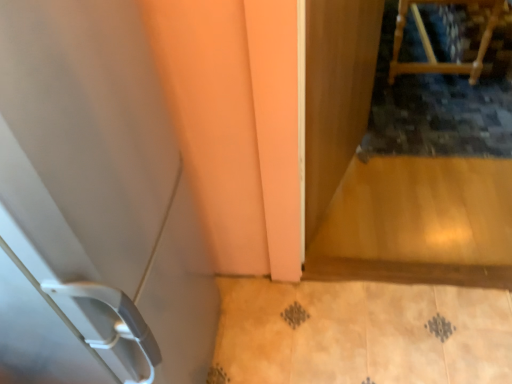
Question: Considering the relative sizes of wooden chair at upper right and transparent wooden screen door at upper right in the image provided, is wooden chair at upper right taller than transparent wooden screen door at upper right?

Choices:
 (A) no
 (B) yes

Answer: (A)

Question: Is wooden chair at upper right far from transparent wooden screen door at upper right?

Choices:
 (A) no
 (B) yes

Answer: (B)

Question: Does wooden chair at upper right turn towards transparent wooden screen door at upper right?

Choices:
 (A) yes
 (B) no

Answer: (B)

Question: Does wooden chair at upper right have a lesser width compared to transparent wooden screen door at upper right?

Choices:
 (A) no
 (B) yes

Answer: (A)

Question: From a real-world perspective, is wooden chair at upper right positioned under transparent wooden screen door at upper right based on gravity?

Choices:
 (A) yes
 (B) no

Answer: (A)

Question: Choose the correct answer: Is wooden chair at upper right inside white plastic door at left or outside it?

Choices:
 (A) inside
 (B) outside

Answer: (B)

Question: From the image's perspective, is wooden chair at upper right above or below white plastic door at left?

Choices:
 (A) below
 (B) above

Answer: (B)

Question: From a real-world perspective, is wooden chair at upper right positioned above or below white plastic door at left?

Choices:
 (A) below
 (B) above

Answer: (A)

Question: Looking at the image, does wooden chair at upper right seem bigger or smaller compared to white plastic door at left?

Choices:
 (A) small
 (B) big

Answer: (A)

Question: From a real-world perspective, is wooden chair at upper right physically located above or below transparent wooden screen door at upper right?

Choices:
 (A) below
 (B) above

Answer: (A)

Question: From the image's perspective, is wooden chair at upper right positioned above or below transparent wooden screen door at upper right?

Choices:
 (A) above
 (B) below

Answer: (A)

Question: Relative to transparent wooden screen door at upper right, is wooden chair at upper right in front or behind?

Choices:
 (A) behind
 (B) front

Answer: (A)

Question: Considering the positions of point pyautogui.click(x=493, y=6) and point pyautogui.click(x=357, y=117), is point pyautogui.click(x=493, y=6) closer or farther from the camera than point pyautogui.click(x=357, y=117)?

Choices:
 (A) farther
 (B) closer

Answer: (A)

Question: From the image's perspective, is white plastic door at left positioned above or below transparent wooden screen door at upper right?

Choices:
 (A) above
 (B) below

Answer: (B)

Question: From a real-world perspective, relative to transparent wooden screen door at upper right, is white plastic door at left vertically above or below?

Choices:
 (A) above
 (B) below

Answer: (A)